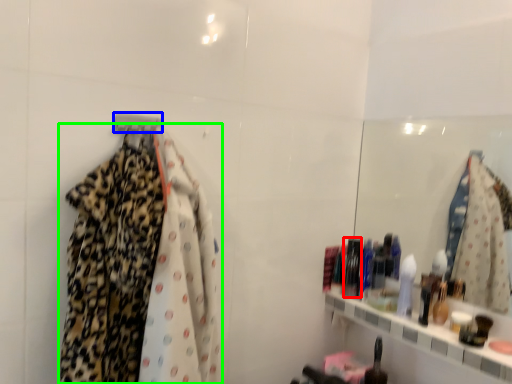
Question: Considering the real-world distances, which object is closest to toiletry (highlighted by a red box)? hanger (highlighted by a blue box) or fancy dress (highlighted by a green box).

Choices:
 (A) hanger
 (B) fancy dress

Answer: (B)